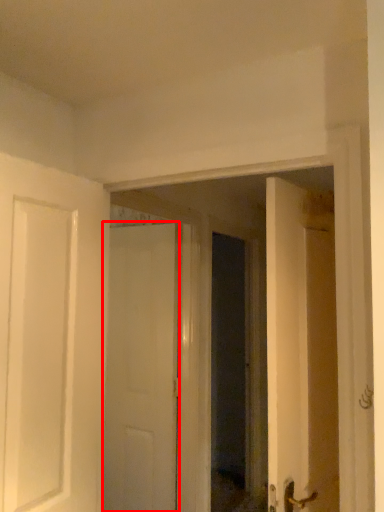
Question: Considering the relative positions of door (annotated by the red box) and glass door in the image provided, where is door (annotated by the red box) located with respect to the staircase?

Choices:
 (A) right
 (B) left

Answer: (B)